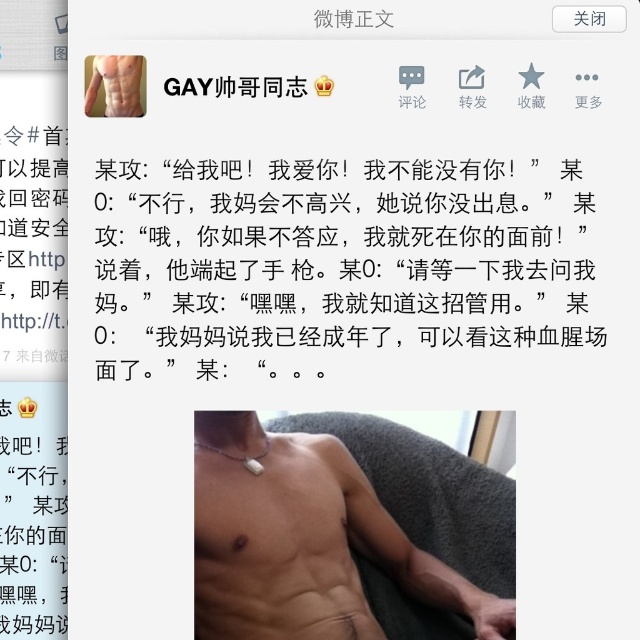
Who is lower down, matte silver necklace at center or matte skin torso at upper center?

matte silver necklace at center is below.

Is the position of matte silver necklace at center more distant than that of matte skin torso at upper center?

Yes.

Is point (268, 595) closer to camera compared to point (125, 76)?

No, (268, 595) is further to viewer.

This screenshot has height=640, width=640. I want to click on matte silver necklace at center, so click(304, 540).

Is white matte text at upper center shorter than matte skin torso at upper center?

Incorrect, white matte text at upper center's height does not fall short of matte skin torso at upper center's.

Between white matte text at upper center and matte skin torso at upper center, which one is positioned lower?

white matte text at upper center is lower down.

Is point (564, 321) farther from viewer compared to point (116, 58)?

Yes.

You are a GUI agent. You are given a task and a screenshot of the screen. Output one action in this format:
    pyautogui.click(x=<x>, y=<y>)
    Task: Click on the white matte text at upper center
    
    Given the screenshot: What is the action you would take?
    pyautogui.click(x=346, y=257)

Between point (262, 316) and point (500, 620), which one is positioned in front?

Point (262, 316)

Find the location of a particular element. The image size is (640, 640). white matte text at upper center is located at coordinates (346, 257).